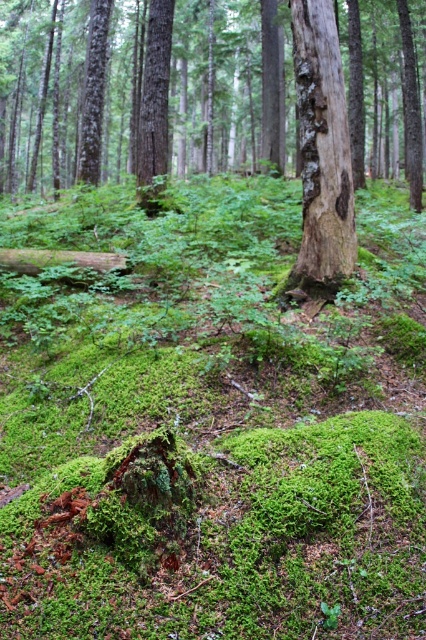
Does point (26, 54) lie behind point (333, 262)?

Yes, it is.

Does smooth bark tree at center have a larger size compared to grayish-brown bark tree trunk at center?

Correct, smooth bark tree at center is larger in size than grayish-brown bark tree trunk at center.

Which is in front, point (282, 140) or point (308, 278)?

Point (308, 278) is in front.

This screenshot has width=426, height=640. Find the location of `smooth bark tree at center`. smooth bark tree at center is located at coordinates (199, 90).